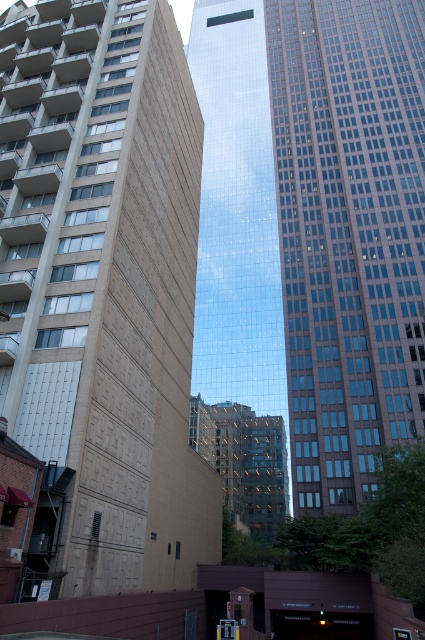
Question: Is brown textured building at center smaller than glassy reflective skyscraper at center?

Choices:
 (A) no
 (B) yes

Answer: (B)

Question: Among these points, which one is farthest from the camera?

Choices:
 (A) pyautogui.click(x=142, y=337)
 (B) pyautogui.click(x=235, y=184)

Answer: (B)

Question: Does brown textured building at center have a greater width compared to glassy reflective skyscraper at center?

Choices:
 (A) no
 (B) yes

Answer: (A)

Question: Can you confirm if brown textured building at center is positioned above glassy reflective skyscraper at center?

Choices:
 (A) no
 (B) yes

Answer: (A)